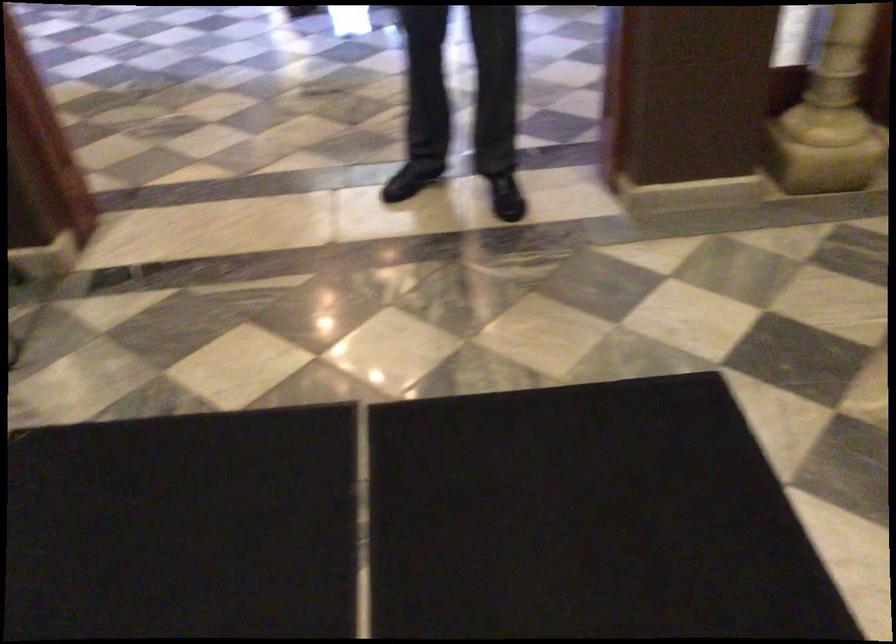
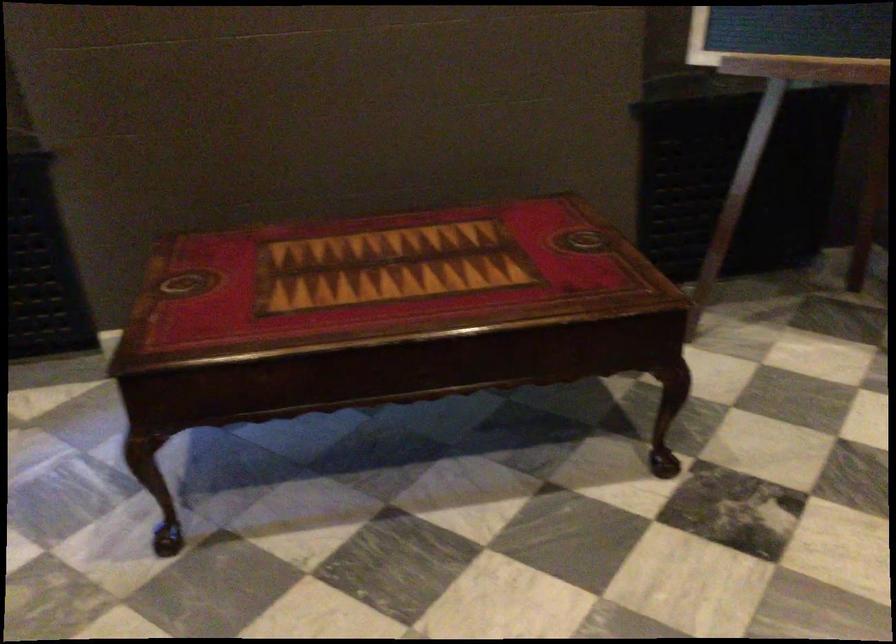
The images are taken continuously from a first-person perspective. In which direction is your viewpoint rotating?

The camera's rotation is toward left-down.